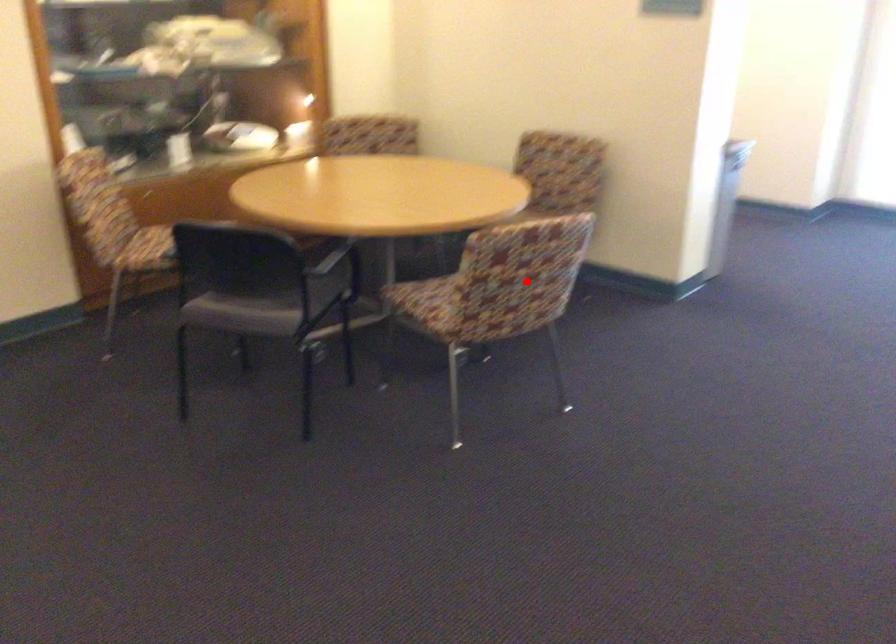
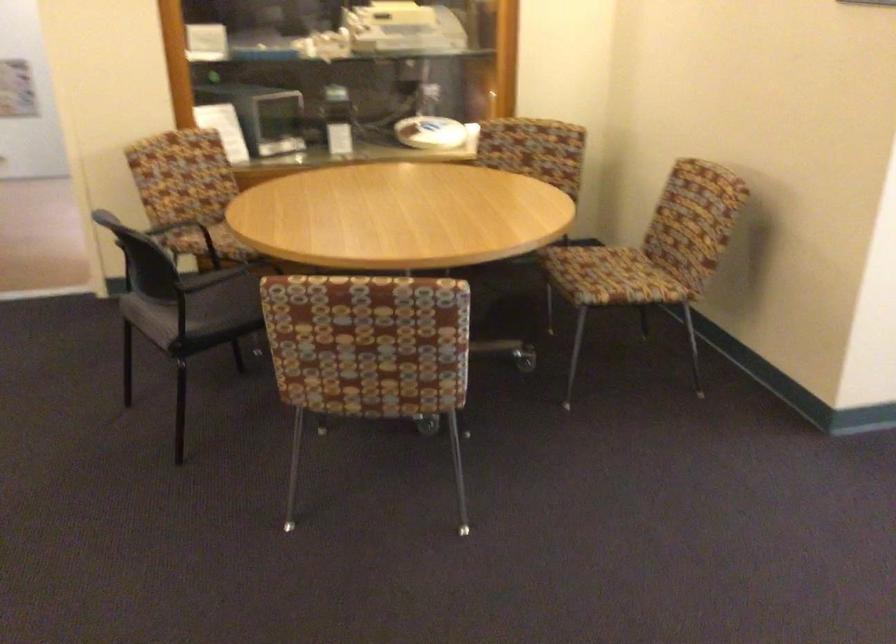
The point at the highlighted location is marked in the first image. Where is the corresponding point in the second image?

(368, 353)